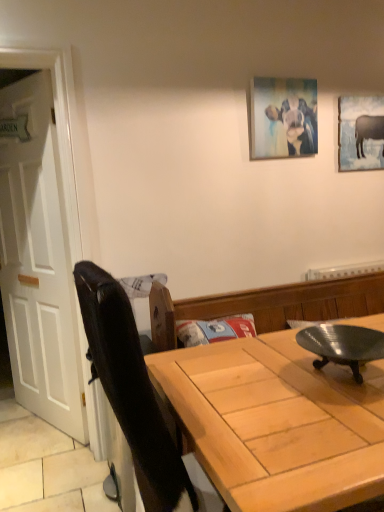
Where is `empty space that is ontop of light wood table at center (from a real-world perspective)`? The width and height of the screenshot is (384, 512). empty space that is ontop of light wood table at center (from a real-world perspective) is located at coordinates (266, 384).